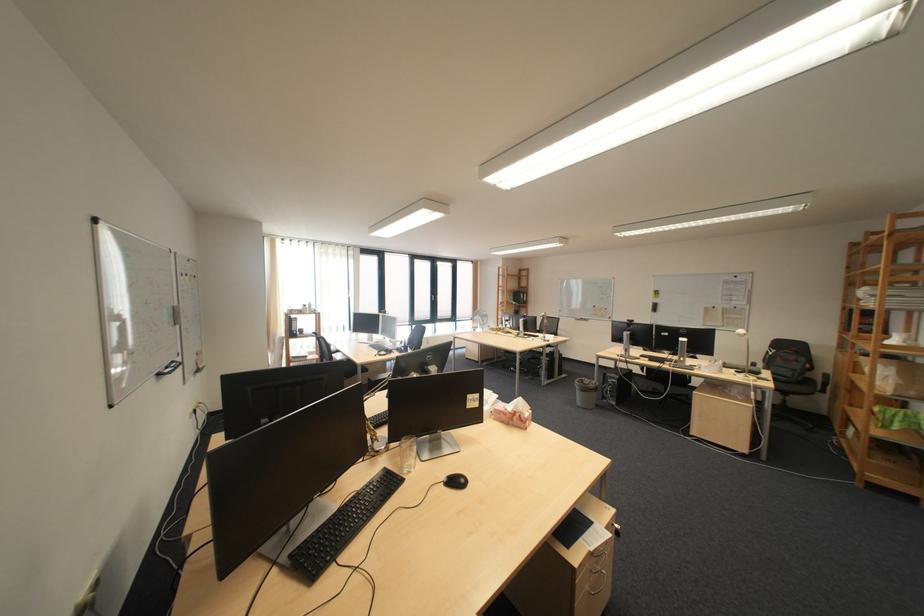
Find where to typ the black keyboard. Please return your answer as a coordinate pair (x, y).

(343, 525)